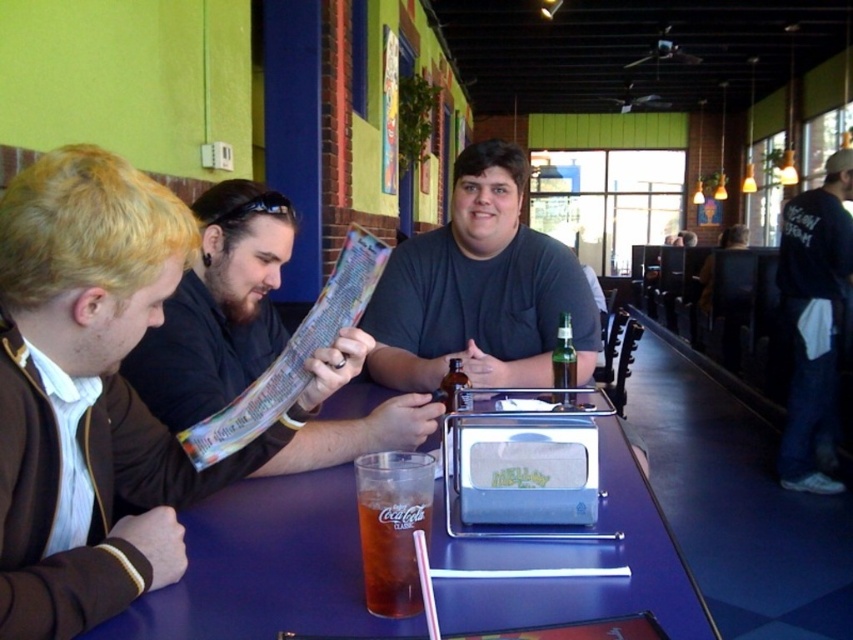
Is point (338, 541) more distant than point (354, 426)?

That is False.

Who is lower down, purple plastic table at center or black paper menu at center?

purple plastic table at center is below.

Is point (619, 561) positioned after point (173, 387)?

No.

Where is `purple plastic table at center`? This screenshot has height=640, width=853. purple plastic table at center is located at coordinates (265, 566).

Which of these two, purple plastic table at center or dark blue cotton shirt at right, stands shorter?

purple plastic table at center is shorter.

Where is `purple plastic table at center`? The image size is (853, 640). purple plastic table at center is located at coordinates (265, 566).

Does purple plastic table at center have a lesser width compared to translucent glass coca-cola at table center?

Incorrect, purple plastic table at center's width is not less than translucent glass coca-cola at table center's.

Is purple plastic table at center bigger than translucent glass coca-cola at table center?

Correct, purple plastic table at center is larger in size than translucent glass coca-cola at table center.

The height and width of the screenshot is (640, 853). What do you see at coordinates (265, 566) in the screenshot?
I see `purple plastic table at center` at bounding box center [265, 566].

The image size is (853, 640). What are the coordinates of `purple plastic table at center` in the screenshot? It's located at (265, 566).